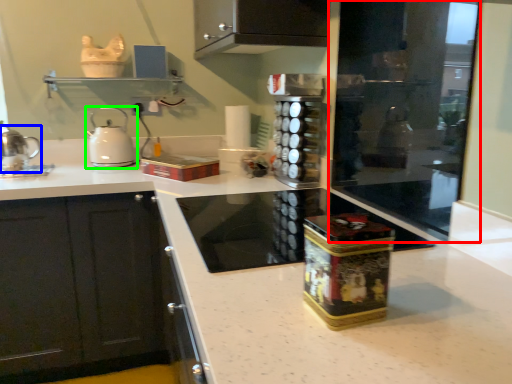
Question: Estimate the real-world distances between objects in this image. Which object is closer to screen door (highlighted by a red box), kitchen appliance (highlighted by a blue box) or kitchen appliance (highlighted by a green box)?

Choices:
 (A) kitchen appliance
 (B) kitchen appliance

Answer: (B)